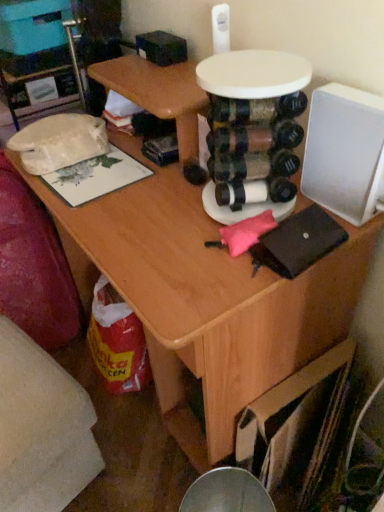
This screenshot has height=512, width=384. I want to click on free location above white plastic round table at center (from a real-world perspective), so click(253, 66).